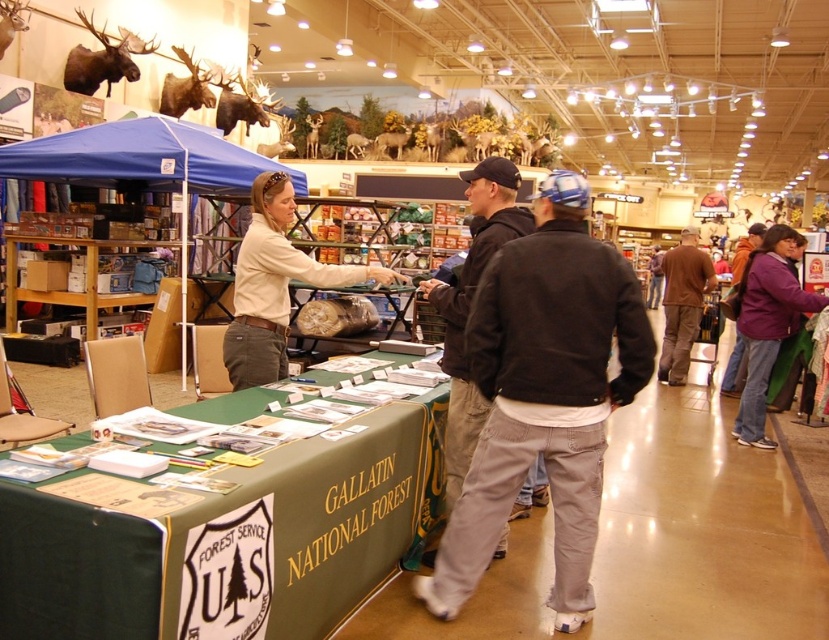
Question: Does green fabric table at center have a lesser width compared to purple fleece jacket at right?

Choices:
 (A) yes
 (B) no

Answer: (B)

Question: In this image, where is white matte shirt at center located relative to purple fleece jacket at right?

Choices:
 (A) below
 (B) above

Answer: (B)

Question: Among these points, which one is nearest to the camera?

Choices:
 (A) (755, 296)
 (B) (153, 182)
 (C) (263, 182)

Answer: (C)

Question: Among these points, which one is farthest from the camera?

Choices:
 (A) coord(677,278)
 (B) coord(774,252)

Answer: (A)

Question: Which point appears closest to the camera in this image?

Choices:
 (A) (663, 257)
 (B) (476, 353)
 (C) (456, 317)
 (D) (265, 292)

Answer: (B)

Question: Is blue fabric canopy at upper left wider than brown cotton shirt at center?

Choices:
 (A) no
 (B) yes

Answer: (B)